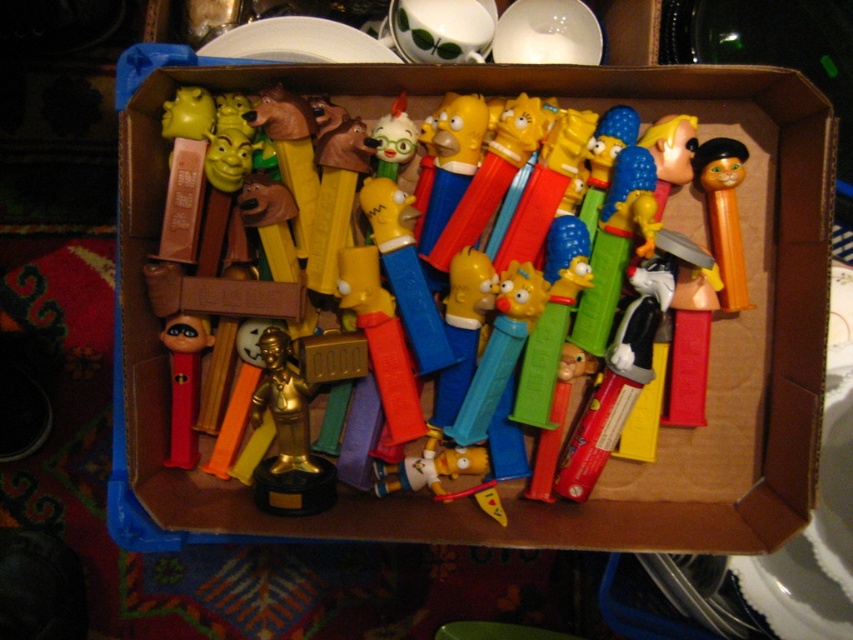
You are looking at the cardboard box filled with Pez dispensers. There are two points inside the box labeled as point (666, 104) and point (173, 456). Which point is closer to you?

Point (666, 104) is further to the camera than point (173, 456), so the point closer to you is point (173, 456).

You are looking at the box of Pez dispensers. There are two points marked in the image, one at coordinate point (726, 168) and another at point (167, 321). Which point is closer to you?

Point (726, 168) is closer to the camera than point (167, 321).